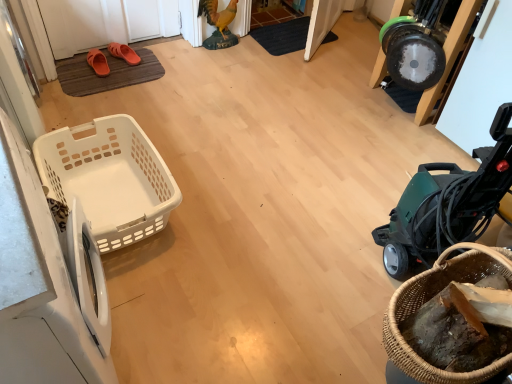
Where is `free space above black textured doormat at center, marked as the 1th doormat in a back-to-front arrangement (from a real-world perspective)`? The height and width of the screenshot is (384, 512). free space above black textured doormat at center, marked as the 1th doormat in a back-to-front arrangement (from a real-world perspective) is located at coordinates (286, 34).